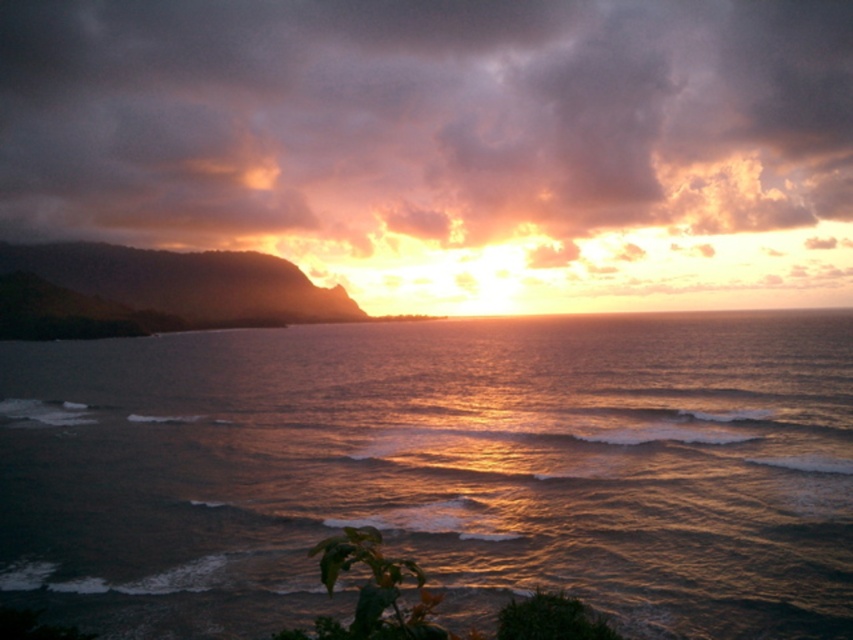
You are an artist trying to paint the sunset scene. You notice the shiny golden water at center and the cloudy sky at upper center. Which one is closer to the bottom of the painting?

The shiny golden water at center is closer to the bottom of the painting because it is shorter than the cloudy sky at upper center.

You are standing on the beach and see the point marked at coordinates (x=438, y=470) in the image. Based on the scene description, what is the most likely feature at that location?

The point at (x=438, y=470) indicates shiny golden water at center, which is likely reflecting the sunset glow.

You are an artist trying to paint the sunset scene. You notice the shiny golden water at center and the cloudy sky at upper center. Which object should you paint first if you want to follow the standard layering technique of painting the background before the foreground?

You should paint the cloudy sky at upper center first because it is the background object positioned above the shiny golden water at center, which is the foreground.